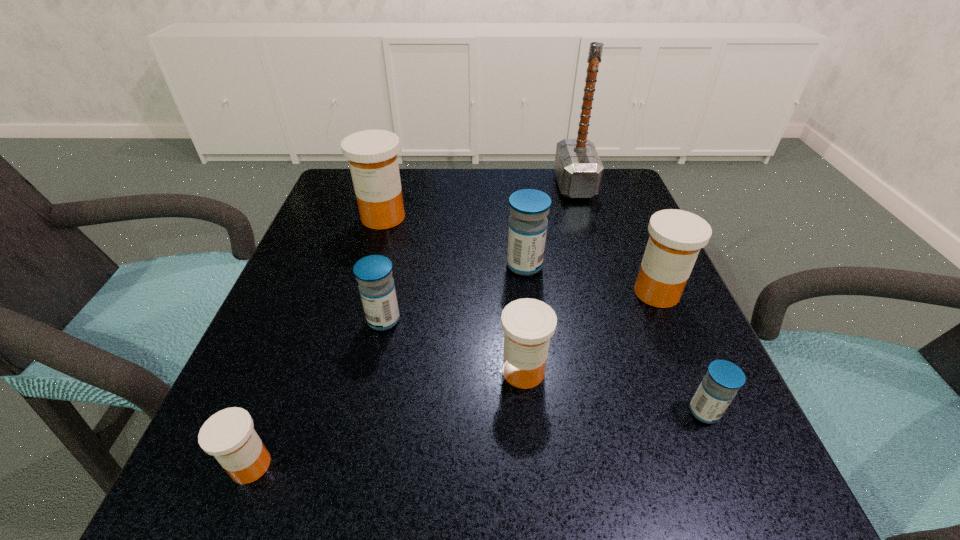
I want to click on free space located on the label of the rightmost orange medicine, so click(527, 293).

Where is `vacant space situated on the label of the rightmost orange medicine`? The height and width of the screenshot is (540, 960). vacant space situated on the label of the rightmost orange medicine is located at coordinates (549, 293).

Locate an element on the screen. The image size is (960, 540). vacant area situated on the label of the rightmost orange medicine is located at coordinates (423, 293).

Locate an element on the screen. vacant space located on the left of the farthest blue medicine is located at coordinates (465, 266).

The image size is (960, 540). In order to click on free space located 0.110m on the left of the leftmost blue medicine in this screenshot , I will do `click(302, 320)`.

Find the location of a particular element. blank space located on the label of the second smallest orange medicine is located at coordinates (528, 423).

Identify the location of vacant area situated on the back of the rightmost blue medicine. Image resolution: width=960 pixels, height=540 pixels. (670, 330).

Locate an element on the screen. This screenshot has width=960, height=540. hammer at the far edge is located at coordinates (578, 168).

Locate an element on the screen. This screenshot has height=540, width=960. medicine that is at the far edge is located at coordinates (372, 154).

At what (x,y) coordinates should I click in order to perform the action: click on object situated at the near edge. Please return your answer as a coordinate pair (x, y). Looking at the image, I should click on (228, 435).